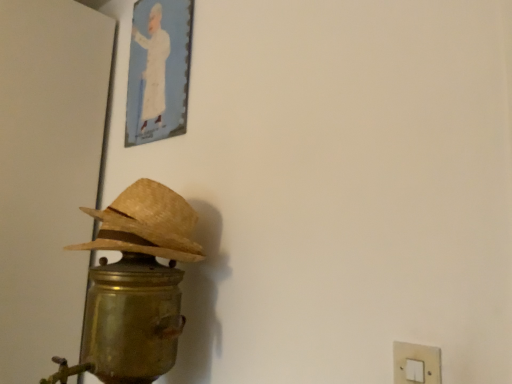
Question: Considering the relative positions of braided straw hat at left and gold metallic table lamp at left in the image provided, is braided straw hat at left in front of gold metallic table lamp at left?

Choices:
 (A) yes
 (B) no

Answer: (B)

Question: Does braided straw hat at left have a greater height compared to gold metallic table lamp at left?

Choices:
 (A) yes
 (B) no

Answer: (B)

Question: Is braided straw hat at left looking in the opposite direction of gold metallic table lamp at left?

Choices:
 (A) yes
 (B) no

Answer: (B)

Question: Is braided straw hat at left smaller than gold metallic table lamp at left?

Choices:
 (A) yes
 (B) no

Answer: (A)

Question: From the image's perspective, is braided straw hat at left beneath gold metallic table lamp at left?

Choices:
 (A) yes
 (B) no

Answer: (B)

Question: Would you say gold metallic table lamp at left is part of braided straw hat at left's contents?

Choices:
 (A) yes
 (B) no

Answer: (B)

Question: From a real-world perspective, is gold metallic table lamp at left physically below white plastic light switch at lower right?

Choices:
 (A) no
 (B) yes

Answer: (A)

Question: Can you confirm if gold metallic table lamp at left is smaller than white plastic light switch at lower right?

Choices:
 (A) no
 (B) yes

Answer: (A)

Question: Are gold metallic table lamp at left and white plastic light switch at lower right far apart?

Choices:
 (A) no
 (B) yes

Answer: (A)

Question: From the image's perspective, is gold metallic table lamp at left located above white plastic light switch at lower right?

Choices:
 (A) no
 (B) yes

Answer: (A)

Question: Is gold metallic table lamp at left to the left of white plastic light switch at lower right from the viewer's perspective?

Choices:
 (A) yes
 (B) no

Answer: (A)

Question: Does gold metallic table lamp at left have a lesser width compared to white plastic light switch at lower right?

Choices:
 (A) yes
 (B) no

Answer: (B)

Question: From a real-world perspective, is white plastic light switch at lower right positioned over gold metallic table lamp at left based on gravity?

Choices:
 (A) no
 (B) yes

Answer: (A)